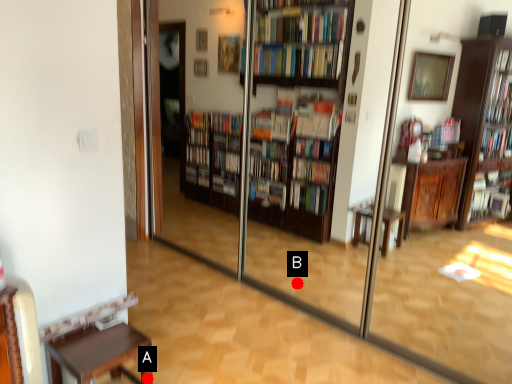
Question: Two points are circled on the image, labeled by A and B beside each circle. Which point is further to the camera?

Choices:
 (A) A is further
 (B) B is further

Answer: (B)